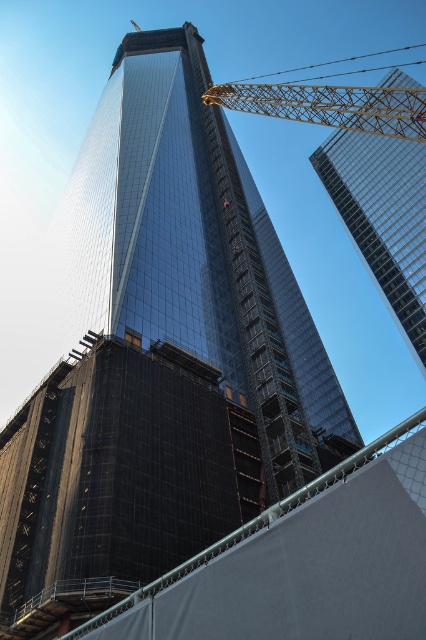
You are an architect inspecting the construction site. You need to determine if the black mesh scaffolding at center can be moved to the right side to allow the crane to access the glassy steel skyscraper at upper right. Based on their widths, will the scaffolding fit in the available space next to the skyscraper?

The black mesh scaffolding at center has a width less than the glassy steel skyscraper at upper right. Therefore, the scaffolding can be moved to the right side as its narrower width will fit in the space next to the skyscraper without obstructing the crane.

You are an architect standing at the construction site. You need to inspect both the black mesh scaffolding at center and the glassy steel skyscraper at upper right. Which object should you prioritize inspecting first based on their spatial relationship?

The black mesh scaffolding at center should be inspected first because it is in front of the glassy steel skyscraper at upper right, making it more accessible from your current position.

You are an architect inspecting the construction site of the glassy steel skyscraper at upper right and the gold mesh crane at upper center. Which structure has a narrower width?

The glassy steel skyscraper at upper right has a narrower width than the gold mesh crane at upper center.